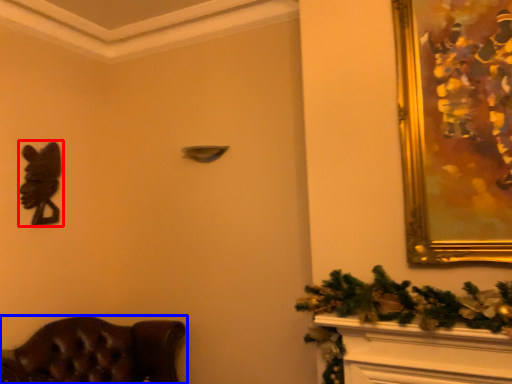
Question: Which object appears farthest to the camera in this image, animal (highlighted by a red box) or furniture (highlighted by a blue box)?

Choices:
 (A) animal
 (B) furniture

Answer: (A)